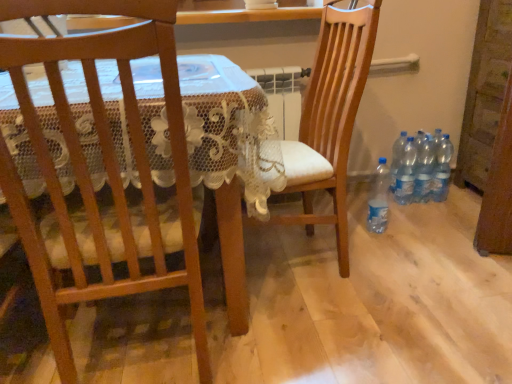
Where is `vacant space in front of clear plastic bottle at lower right, which appears as the 5th bottle when viewed from the right`? This screenshot has height=384, width=512. vacant space in front of clear plastic bottle at lower right, which appears as the 5th bottle when viewed from the right is located at coordinates (385, 248).